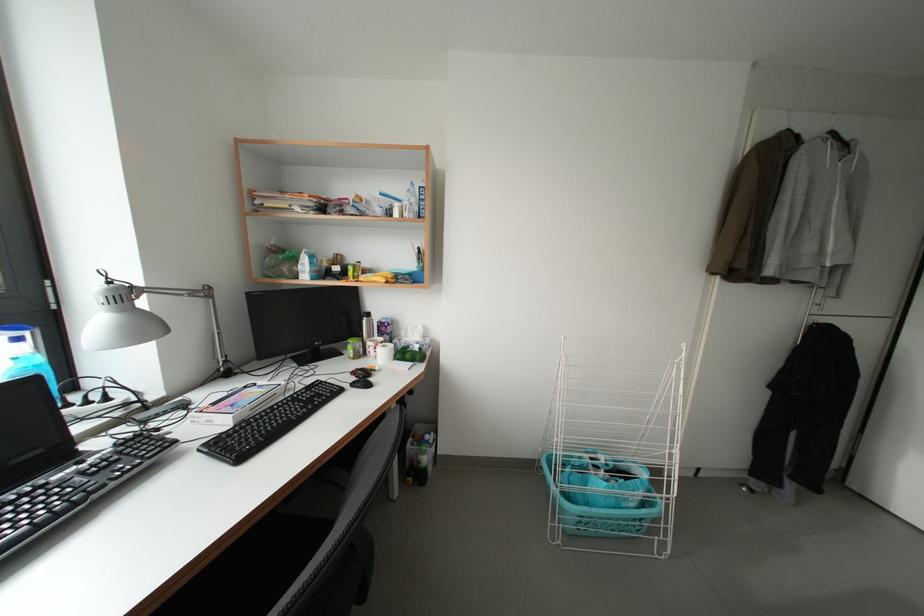
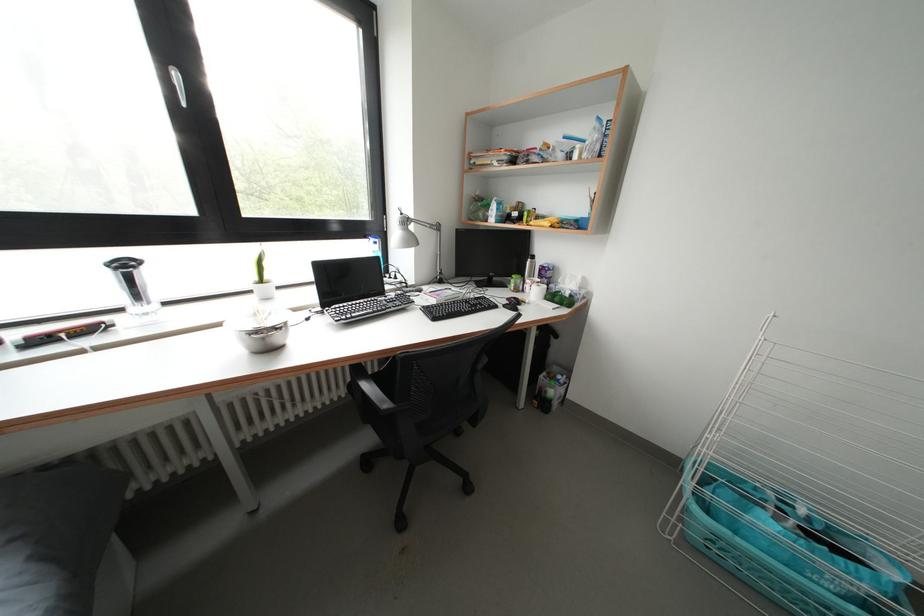
Where in the second image is the point corresponding to (x=359, y=378) from the first image?

(515, 304)